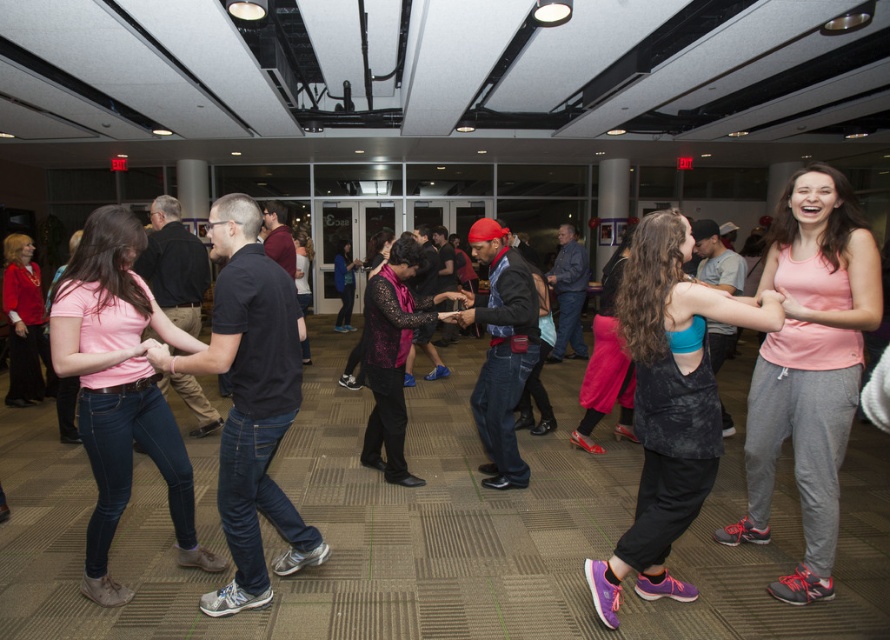
You are a photographer holding a camera. You want to take a photo of the matte black tank top at center from a distance that ensures the subject is in focus. The camera requires a minimum distance of 2 meters to focus properly. Can you take the photo without moving closer?

The matte black tank top at center and camera are 2.01 meters apart. Since the required minimum distance is 2 meters, the photographer can take the photo without moving closer as the distance is sufficient.